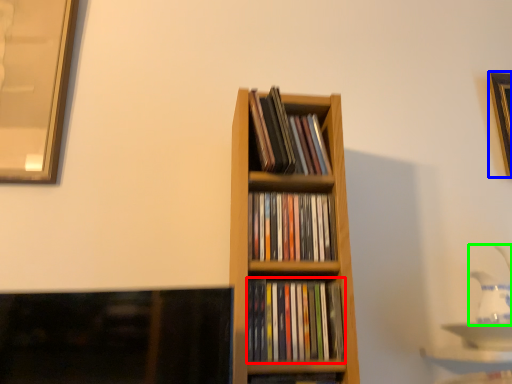
Question: Which is farther away from book (highlighted by a red box)? picture frame (highlighted by a blue box) or tea pot (highlighted by a green box)?

Choices:
 (A) picture frame
 (B) tea pot

Answer: (A)